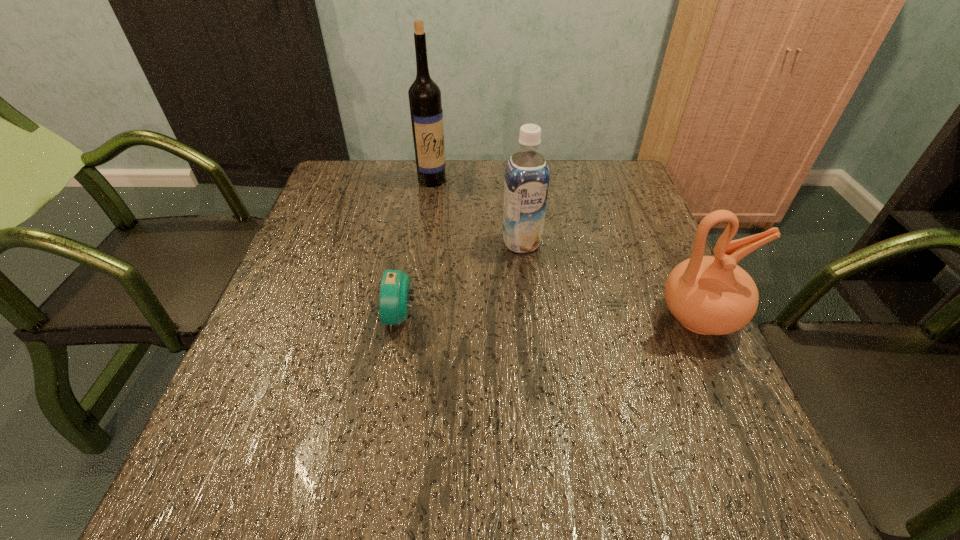
Where is `vacant area that lies between the shortest object and the second farthest object`? vacant area that lies between the shortest object and the second farthest object is located at coordinates (462, 280).

Find the location of a particular element. This screenshot has height=540, width=960. vacant point located between the second farthest object and the tallest object is located at coordinates (477, 211).

At what (x,y) coordinates should I click in order to perform the action: click on unoccupied area between the shortest object and the tallest object. Please return your answer as a coordinate pair (x, y). Looking at the image, I should click on (417, 248).

At what (x,y) coordinates should I click in order to perform the action: click on free spot between the tallest object and the soya milk. Please return your answer as a coordinate pair (x, y). Looking at the image, I should click on (477, 211).

This screenshot has width=960, height=540. Find the location of `object that can be found as the third closest to the wine bottle`. object that can be found as the third closest to the wine bottle is located at coordinates (708, 295).

Find the location of a particular element. This screenshot has height=540, width=960. object identified as the closest to the alarm clock is located at coordinates (526, 184).

What are the coordinates of `vacant area in the image that satisfies the following two spatial constraints: 1. on the front side of the rightmost object; 2. on the spout of the third nearest object` in the screenshot? It's located at (529, 318).